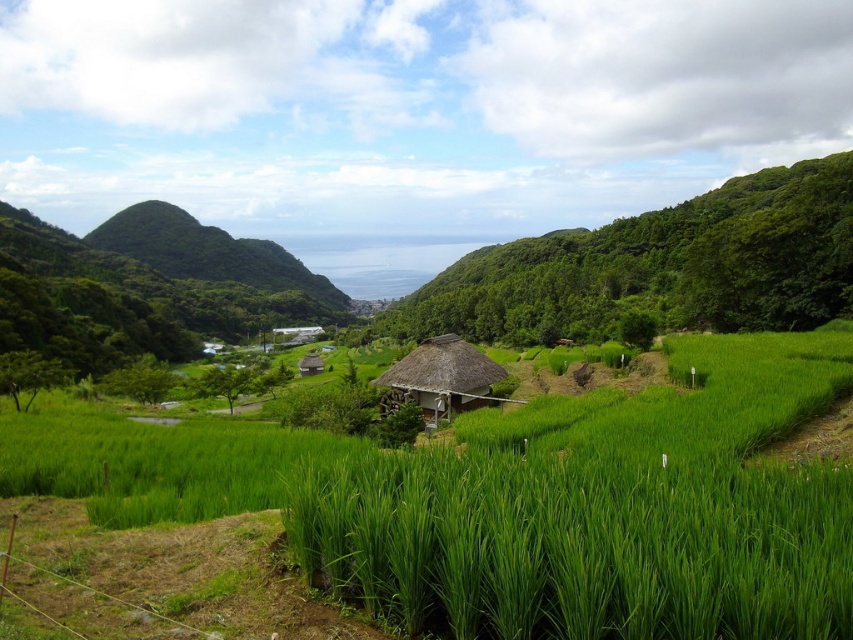
Question: Is green grass at center to the left of thatched roof hut at center from the viewer's perspective?

Choices:
 (A) yes
 (B) no

Answer: (B)

Question: Can you confirm if green grass at center is positioned to the right of thatched roof hut at center?

Choices:
 (A) yes
 (B) no

Answer: (A)

Question: Does green grass at center have a smaller size compared to thatched roof hut at center?

Choices:
 (A) no
 (B) yes

Answer: (A)

Question: Which object appears closest to the camera in this image?

Choices:
 (A) green grass at center
 (B) thatched roof hut at center

Answer: (A)